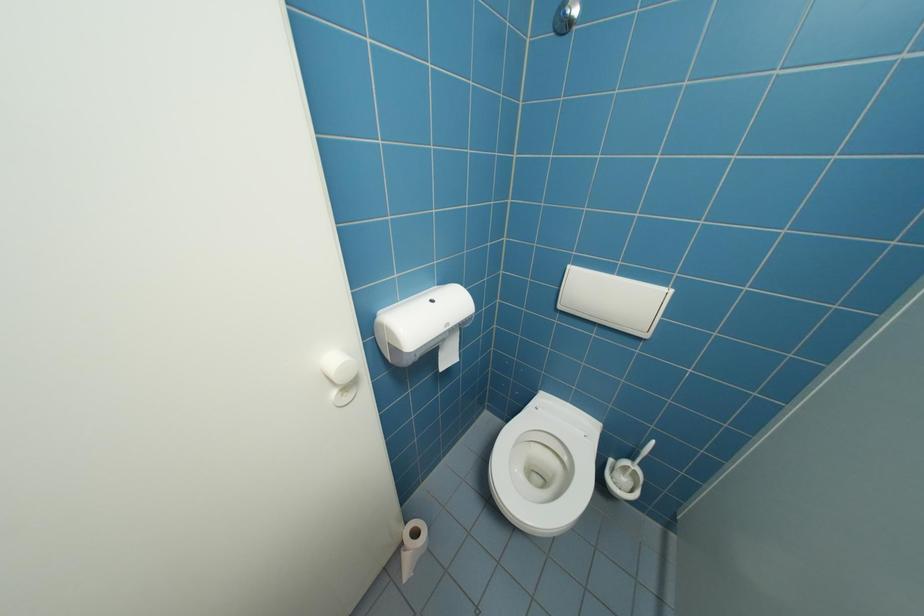
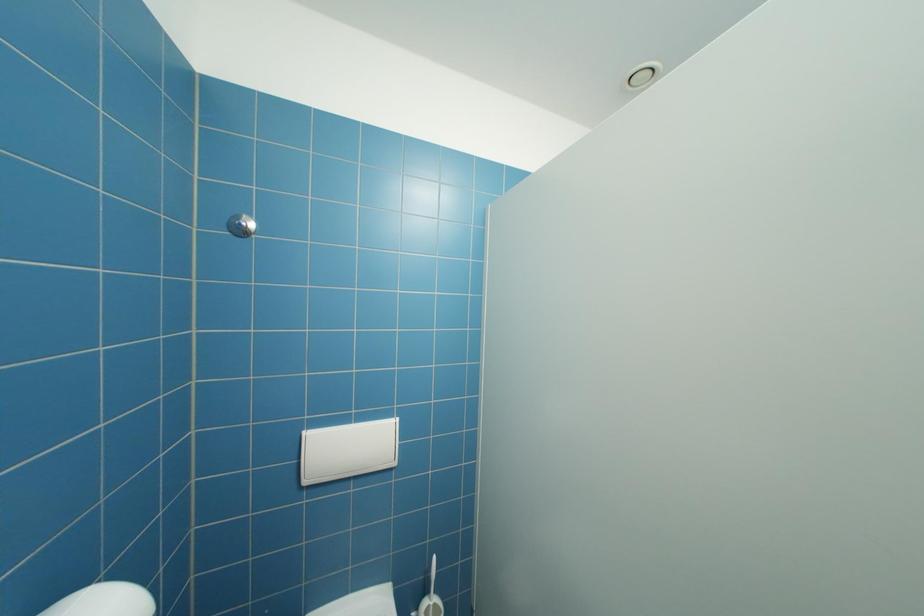
Question: The camera is either moving clockwise (left) or counter-clockwise (right) around the object. The first image is from the beginning of the video and the second image is from the end. Is the camera moving left or right when shooting the video?

Choices:
 (A) Left
 (B) Right

Answer: (A)